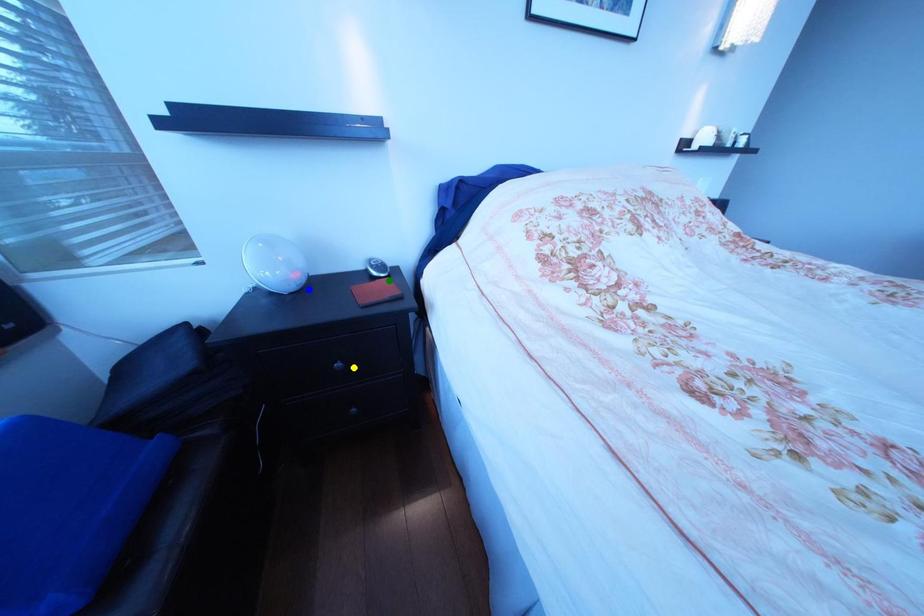
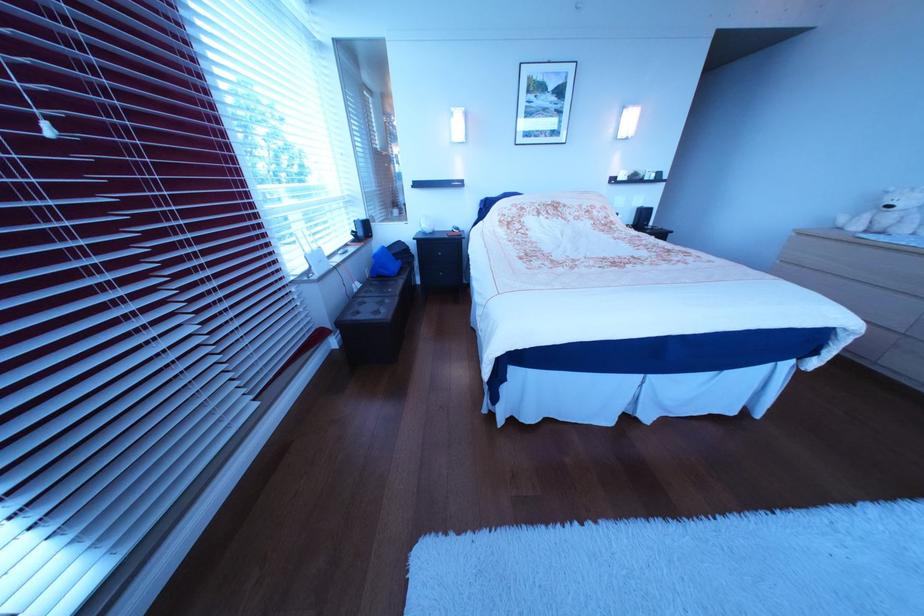
I am providing you with two images of the same scene from different viewpoints. Three points are marked in image1. Which point corresponds to a part or object that is occluded in image2?In image1, three points are marked. Which of them correspond to a part or object that is occluded in image2?Among the three points shown in image1, which one corresponds to a part or object that is no longer visible due to occlusion in image2?

Invisible in image2: green point.